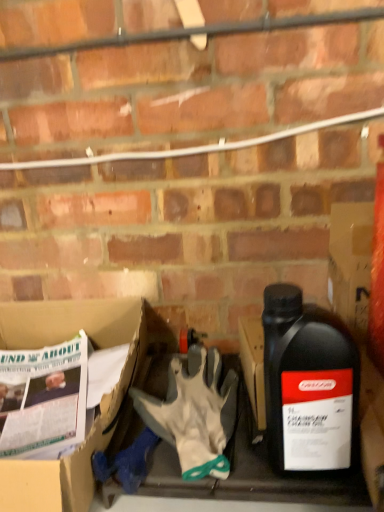
Where is `free space to the left of black plastic bottle at right`? The width and height of the screenshot is (384, 512). free space to the left of black plastic bottle at right is located at coordinates (233, 450).